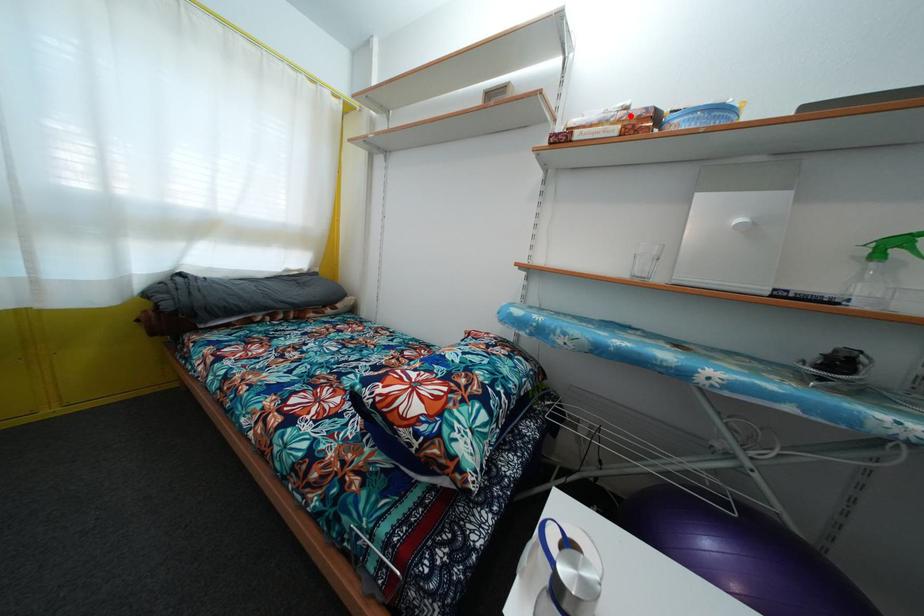
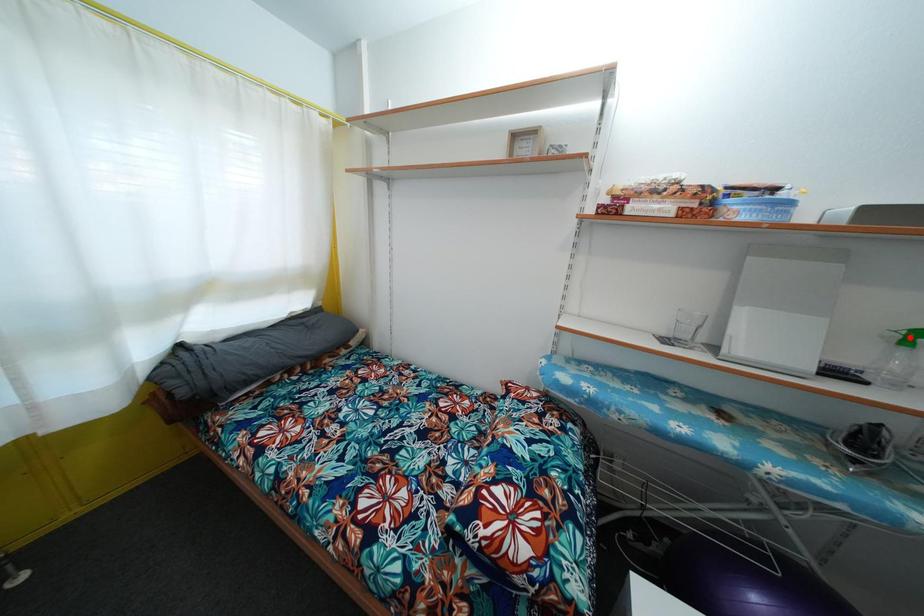
I am providing you with two images of the same scene from different viewpoints. A red point is marked on the first image and another point is marked on the second image. Is the marked point in image1 the same physical position as the marked point in image2?

No